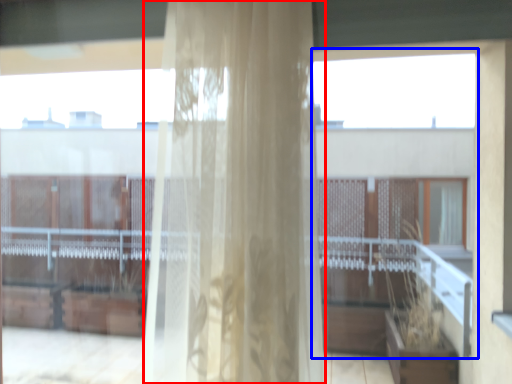
Question: Among these objects, which one is farthest to the camera, curtain (highlighted by a red box) or glass window (highlighted by a blue box)?

Choices:
 (A) curtain
 (B) glass window

Answer: (B)